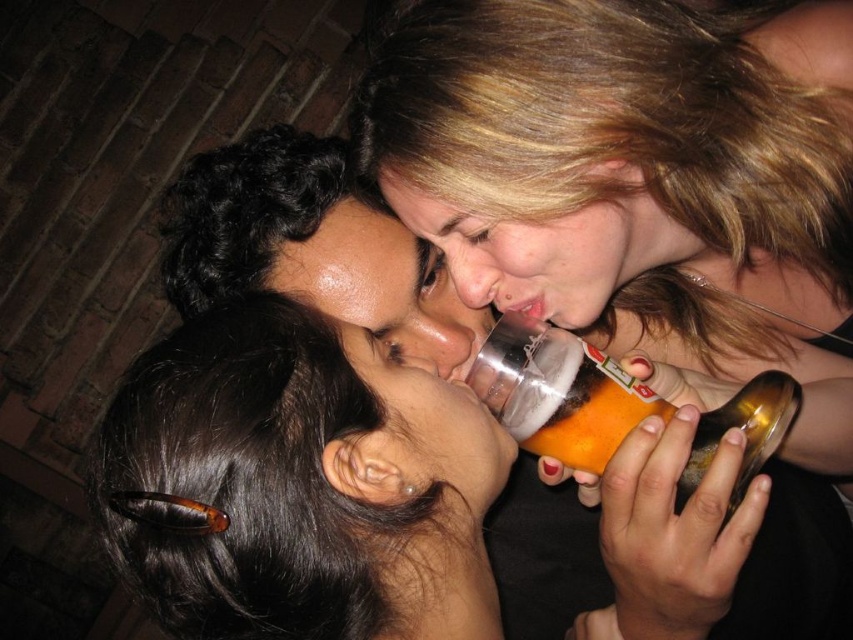
Question: Is translucent plastic cup at upper center to the right of matte plastic bottle at center from the viewer's perspective?

Choices:
 (A) no
 (B) yes

Answer: (B)

Question: Which point is closer to the camera?

Choices:
 (A) (403, 492)
 (B) (488, 70)
 (C) (747, 440)

Answer: (A)

Question: Considering the relative positions of translucent plastic cup at upper center and translucent plastic bottle at center in the image provided, where is translucent plastic cup at upper center located with respect to translucent plastic bottle at center?

Choices:
 (A) below
 (B) above

Answer: (B)

Question: Is matte plastic bottle at center thinner than translucent plastic bottle at center?

Choices:
 (A) no
 (B) yes

Answer: (A)

Question: Which point is farther to the camera?

Choices:
 (A) translucent plastic cup at upper center
 (B) translucent plastic bottle at center
 (C) matte plastic bottle at center

Answer: (A)

Question: Among these objects, which one is farthest from the camera?

Choices:
 (A) translucent plastic bottle at center
 (B) translucent plastic cup at upper center
 (C) matte plastic bottle at center

Answer: (B)